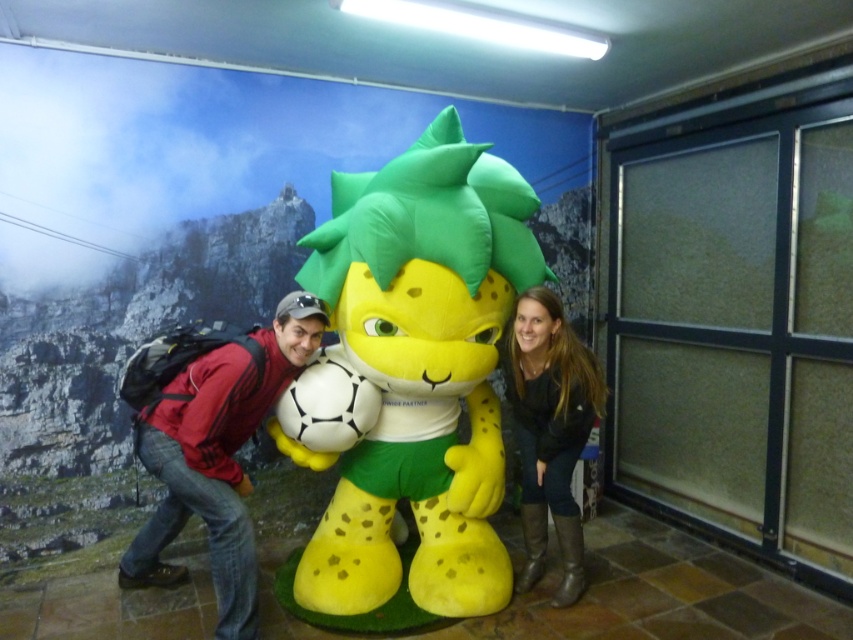
Does yellow plush mascot at center appear over red fleece jacket at left?

Yes, yellow plush mascot at center is above red fleece jacket at left.

Does point (505, 278) come in front of point (125, 554)?

Yes.

Which is in front, point (495, 422) or point (160, 476)?

Point (160, 476) is more forward.

Locate an element on the screen. yellow plush mascot at center is located at coordinates (421, 371).

Between red fleece jacket at left and dark brown leather boots at lower right, which one has less height?

red fleece jacket at left is shorter.

Is point (241, 612) positioned after point (544, 371)?

No, (241, 612) is in front of (544, 371).

Is point (167, 524) behind point (544, 468)?

No, it is not.

Find the location of `red fleece jacket at left`. red fleece jacket at left is located at coordinates (213, 451).

Based on the photo, who is lower down, yellow plush mascot at center or dark brown leather boots at lower right?

dark brown leather boots at lower right is lower down.

Is point (469, 342) positioned before point (529, 500)?

That is True.

Identify the location of yellow plush mascot at center. Image resolution: width=853 pixels, height=640 pixels. (x=421, y=371).